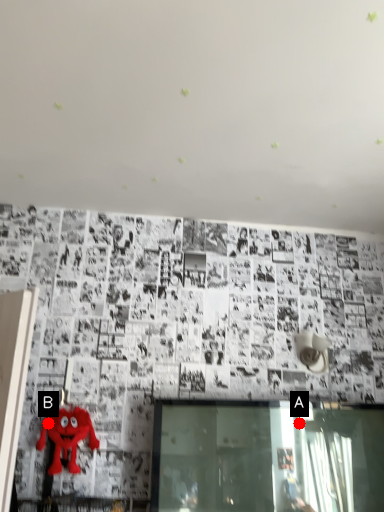
Question: Two points are circled on the image, labeled by A and B beside each circle. Which point is closer to the camera?

Choices:
 (A) A is closer
 (B) B is closer

Answer: (B)